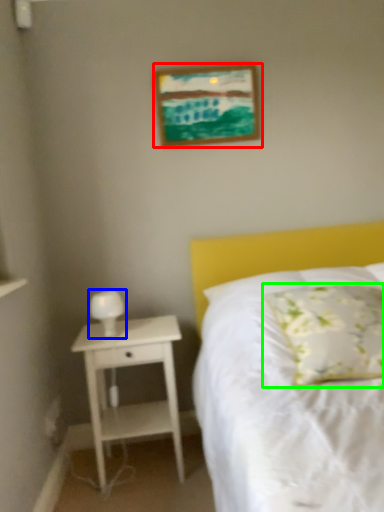
Question: Which is farther away from picture frame (highlighted by a red box)? bedside lamp (highlighted by a blue box) or pillow (highlighted by a green box)?

Choices:
 (A) bedside lamp
 (B) pillow

Answer: (B)